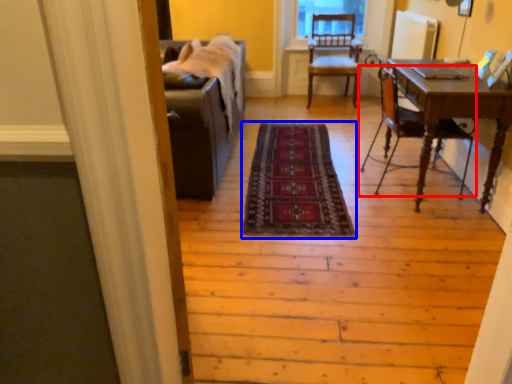
Question: Which point is further to the camera, chair (highlighted by a red box) or mat (highlighted by a blue box)?

Choices:
 (A) chair
 (B) mat

Answer: (A)